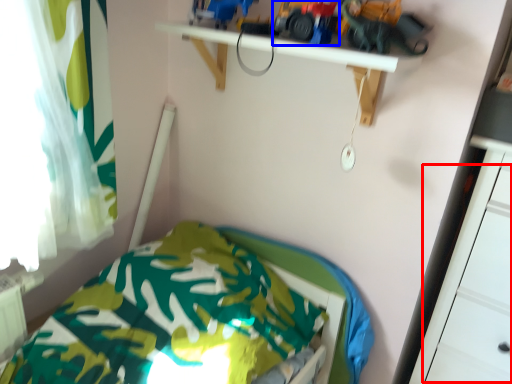
Question: Which of the following is the closest to the observer, drawer (highlighted by a red box) or toy car (highlighted by a blue box)?

Choices:
 (A) drawer
 (B) toy car

Answer: (A)